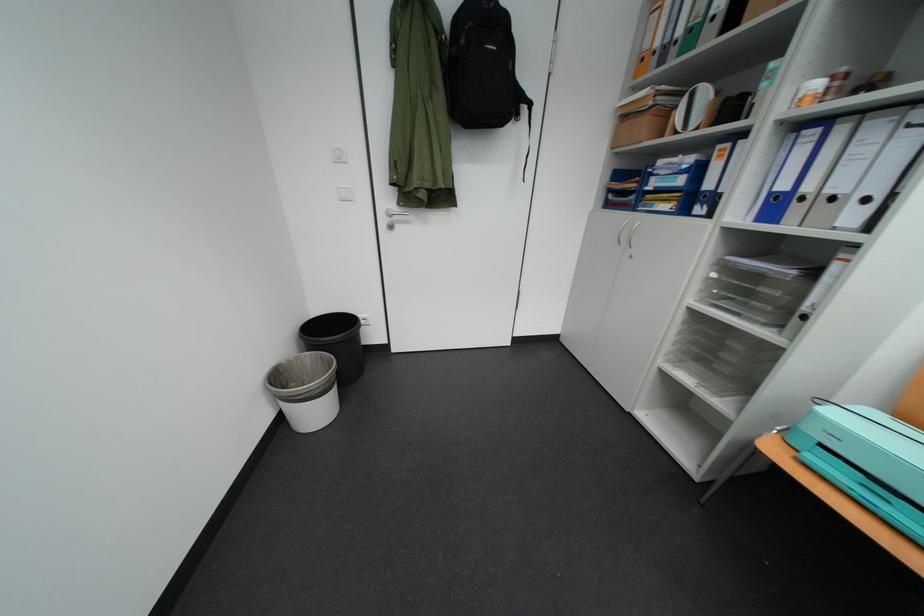
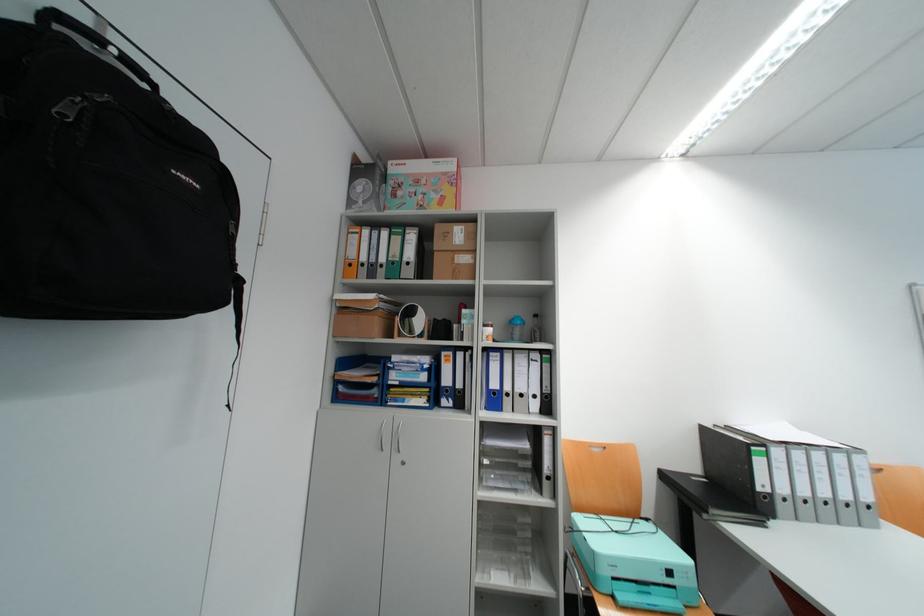
Locate, in the second image, the point that corresponds to (748,26) in the first image.

(444, 280)